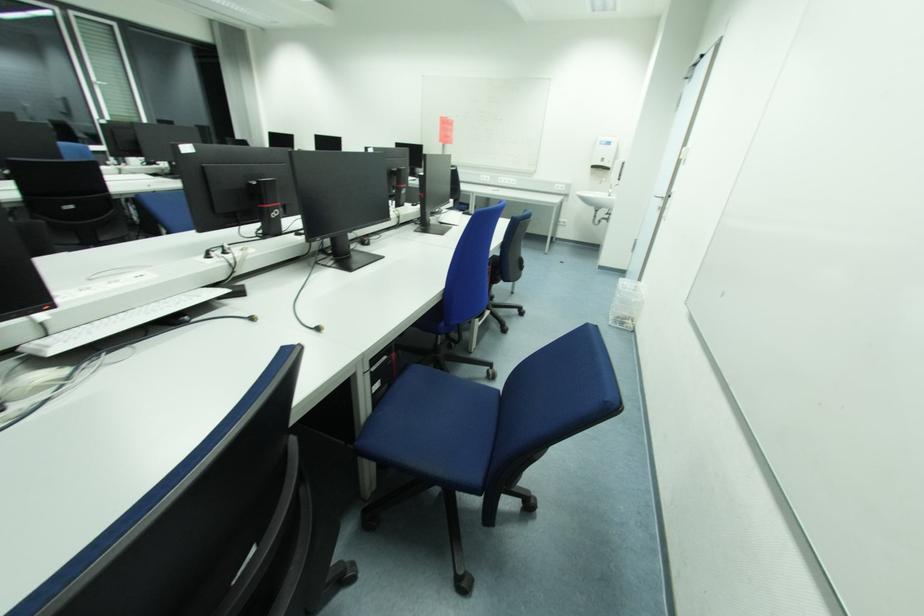
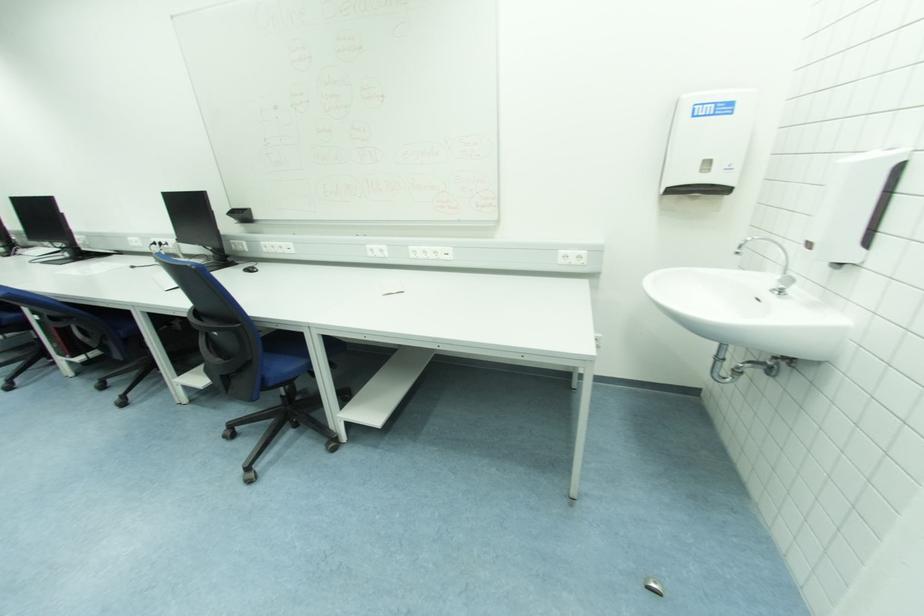
In the second image, find the point that corresponds to [612,145] in the first image.

(731, 110)